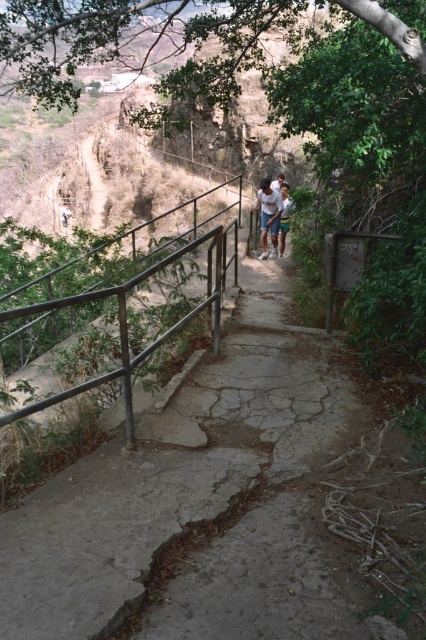
Which is behind, point (215, 323) or point (273, 204)?

The point (273, 204) is more distant.

Measure the distance between metal/smooth rail at center and camera.

2.72 meters

This screenshot has height=640, width=426. Find the location of `metal/smooth rail at center`. metal/smooth rail at center is located at coordinates (126, 316).

The width and height of the screenshot is (426, 640). I want to click on cracked concrete path at center, so click(x=221, y=499).

From the picture: Can you confirm if cracked concrete path at center is positioned above light blue denim shorts at center?

Incorrect, cracked concrete path at center is not positioned above light blue denim shorts at center.

Describe the element at coordinates (221, 499) in the screenshot. This screenshot has width=426, height=640. I see `cracked concrete path at center` at that location.

You are a GUI agent. You are given a task and a screenshot of the screen. Output one action in this format:
    pyautogui.click(x=<x>, y=<y>)
    Task: Click on the cracked concrete path at center
    The image size is (426, 640).
    Given the screenshot: What is the action you would take?
    pyautogui.click(x=221, y=499)

Who is higher up, cracked concrete path at center or metal/smooth rail at center?

metal/smooth rail at center is above.

Where is `cracked concrete path at center`? Image resolution: width=426 pixels, height=640 pixels. cracked concrete path at center is located at coordinates (221, 499).

What are the coordinates of `cracked concrete path at center` in the screenshot? It's located at (221, 499).